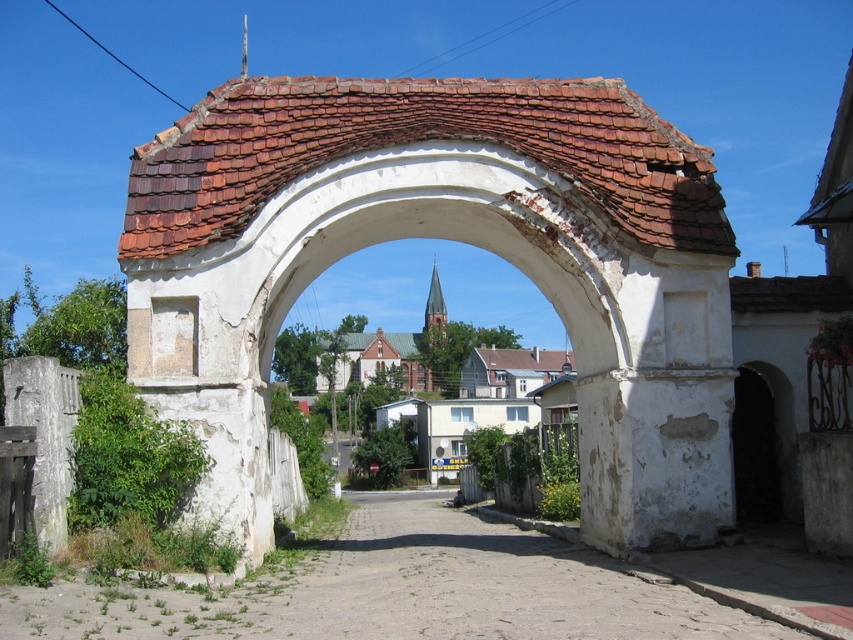
Question: Is brown brick church at center bigger than gray concrete gate at left?

Choices:
 (A) no
 (B) yes

Answer: (B)

Question: Which of the following is the farthest from the observer?

Choices:
 (A) dirt road at center
 (B) brown brick church at center

Answer: (B)

Question: Which object is positioned farthest from the brown brick church at center?

Choices:
 (A) gray concrete gate at left
 (B) dirt road at center

Answer: (A)

Question: Among these objects, which one is nearest to the camera?

Choices:
 (A) brown brick church at center
 (B) dirt road at center

Answer: (B)

Question: Considering the relative positions of brown brick church at center and gray concrete gate at left in the image provided, where is brown brick church at center located with respect to gray concrete gate at left?

Choices:
 (A) below
 (B) above

Answer: (A)

Question: Is dirt road at center positioned behind brown brick church at center?

Choices:
 (A) no
 (B) yes

Answer: (A)